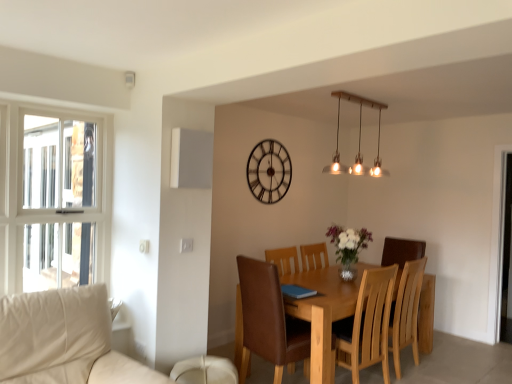
Question: Is metallic clock at upper center wider or thinner than matte brass pendant lights at upper center?

Choices:
 (A) thin
 (B) wide

Answer: (A)

Question: Considering the relative positions of metallic clock at upper center and matte brass pendant lights at upper center in the image provided, is metallic clock at upper center to the left or to the right of matte brass pendant lights at upper center?

Choices:
 (A) left
 (B) right

Answer: (A)

Question: Considering the real-world distances, which object is farthest from the translucent glass vase at center?

Choices:
 (A) brown leather chair at center, the second chair when ordered from back to front
 (B) metallic clock at upper center
 (C) light brown wood chair at center, the 1th chair when ordered from right to left
 (D) matte brass pendant lights at upper center
 (E) light brown wooden table at center

Answer: (D)

Question: Estimate the real-world distances between objects in this image. Which object is farther from the metallic clock at upper center?

Choices:
 (A) light brown wood chair at center, the first chair from the back
 (B) brown leather chair at center, the second chair when ordered from back to front
 (C) light brown wooden table at center
 (D) matte brass pendant lights at upper center
 (E) translucent glass vase at center

Answer: (A)